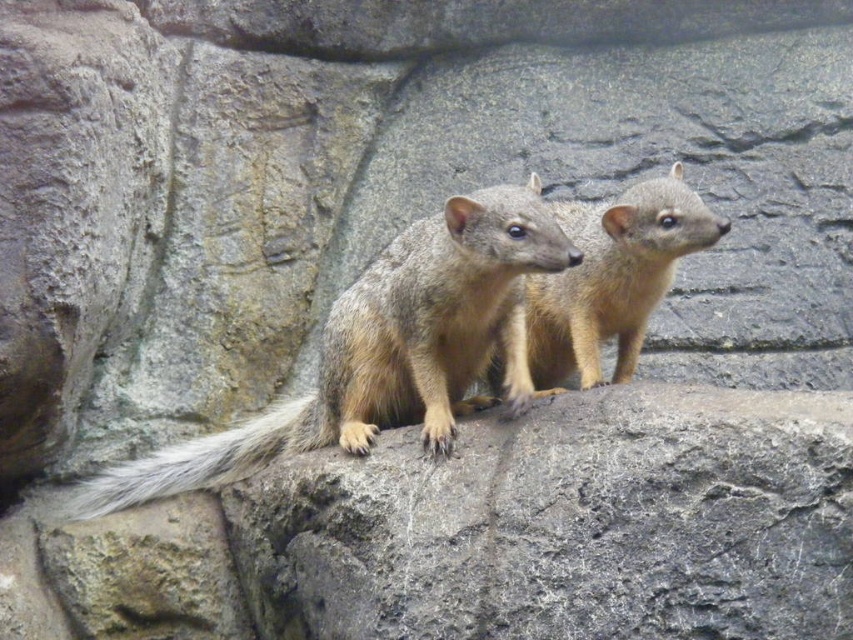
Question: Which object appears farthest from the camera in this image?

Choices:
 (A) gray-furred squirrel at center
 (B) white fluffy tail at center

Answer: (B)

Question: Does gray-furred squirrel at center have a lesser width compared to white fluffy tail at center?

Choices:
 (A) yes
 (B) no

Answer: (B)

Question: Can you confirm if gray-furred squirrel at center is positioned to the left of white fluffy tail at center?

Choices:
 (A) yes
 (B) no

Answer: (B)

Question: Can you confirm if gray-furred squirrel at center is positioned above white fluffy tail at center?

Choices:
 (A) yes
 (B) no

Answer: (A)

Question: Among these points, which one is nearest to the camera?

Choices:
 (A) (x=227, y=461)
 (B) (x=479, y=301)

Answer: (B)